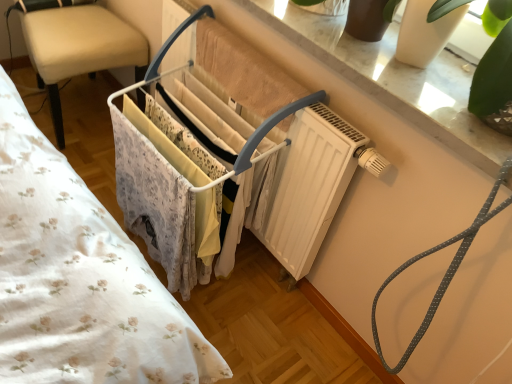
In order to click on gray dotted rope at upper right in this screenshot , I will do `click(446, 271)`.

Describe the element at coordinates (153, 199) in the screenshot. I see `white plastic clothes rack at center` at that location.

Where is `white plastic clothes rack at center`? The image size is (512, 384). white plastic clothes rack at center is located at coordinates (153, 199).

The width and height of the screenshot is (512, 384). What are the coordinates of `beige leather chair at left` in the screenshot? It's located at (77, 45).

From the image's perspective, is white marble window sill at upper center located above beige leather chair at left?

No, from the image's perspective, white marble window sill at upper center is not over beige leather chair at left.

In the scene shown: In the image, is white marble window sill at upper center on the left side or the right side of beige leather chair at left?

white marble window sill at upper center is to the right of beige leather chair at left.

Which of these two, white marble window sill at upper center or beige leather chair at left, is wider?

Wider between the two is beige leather chair at left.

Could you tell me if white marble window sill at upper center is facing beige leather chair at left?

No, white marble window sill at upper center is not facing towards beige leather chair at left.

From the image's perspective, is beige leather chair at left beneath white marble window sill at upper center?

Incorrect, from the image's perspective, beige leather chair at left is higher than white marble window sill at upper center.

Does beige leather chair at left have a lesser width compared to white marble window sill at upper center?

In fact, beige leather chair at left might be wider than white marble window sill at upper center.

Is beige leather chair at left not close to white marble window sill at upper center?

No, beige leather chair at left is not far away from white marble window sill at upper center.

Is gray dotted rope at upper right outside of white marble window sill at upper center?

gray dotted rope at upper right is positioned outside white marble window sill at upper center.

Is gray dotted rope at upper right bigger than white marble window sill at upper center?

Yes.

Would you consider gray dotted rope at upper right to be distant from white marble window sill at upper center?

Actually, gray dotted rope at upper right and white marble window sill at upper center are a little close together.

Is point (466, 229) farther from camera compared to point (371, 53)?

No, (466, 229) is closer to viewer.

Considering the sizes of white plastic clothes rack at center and beige leather chair at left in the image, is white plastic clothes rack at center bigger or smaller than beige leather chair at left?

Considering their sizes, white plastic clothes rack at center takes up more space than beige leather chair at left.

From the image's perspective, which one is positioned higher, white plastic clothes rack at center or beige leather chair at left?

From the image's view, beige leather chair at left is above.

What's the angular difference between white plastic clothes rack at center and beige leather chair at left's facing directions?

88 degrees.

Is white plastic clothes rack at center turned away from beige leather chair at left?

No, white plastic clothes rack at center's orientation is not away from beige leather chair at left.

Does gray dotted rope at upper right turn towards white plastic clothes rack at center?

No.

Does gray dotted rope at upper right have a lesser width compared to white plastic clothes rack at center?

Yes.

Is gray dotted rope at upper right taller than white plastic clothes rack at center?

Correct, gray dotted rope at upper right is much taller as white plastic clothes rack at center.

How many degrees apart are the facing directions of gray dotted rope at upper right and white plastic clothes rack at center?

There is a 5.69-degree angle between the facing directions of gray dotted rope at upper right and white plastic clothes rack at center.

Is point (494, 135) closer or farther from the camera than point (126, 137)?

Point (494, 135).

Who is bigger, white marble window sill at upper center or white plastic clothes rack at center?

Bigger between the two is white plastic clothes rack at center.

Is there a large distance between white marble window sill at upper center and white plastic clothes rack at center?

That's not correct — white marble window sill at upper center is a little close to white plastic clothes rack at center.

What's the angular difference between white marble window sill at upper center and white plastic clothes rack at center's facing directions?

1.02 degrees separate the facing orientations of white marble window sill at upper center and white plastic clothes rack at center.

Would you say white plastic clothes rack at center is inside or outside gray dotted rope at upper right?

white plastic clothes rack at center lies outside gray dotted rope at upper right.

Where is `closet lying above the gray dotted rope at upper right (from the image's perspective)`? closet lying above the gray dotted rope at upper right (from the image's perspective) is located at coordinates (153, 199).

Between white plastic clothes rack at center and gray dotted rope at upper right, which one is positioned in front?

gray dotted rope at upper right is closer to the camera.

What's the angular difference between white plastic clothes rack at center and gray dotted rope at upper right's facing directions?

5.69 degrees.

Where is `window sill above the beige leather chair at left (from a real-world perspective)`? The width and height of the screenshot is (512, 384). window sill above the beige leather chair at left (from a real-world perspective) is located at coordinates (394, 79).

This screenshot has width=512, height=384. In order to click on chair above the white marble window sill at upper center (from the image's perspective) in this screenshot , I will do `click(77, 45)`.

Which object lies further to the anchor point white marble window sill at upper center, white plastic clothes rack at center or beige leather chair at left?

The object further to white marble window sill at upper center is beige leather chair at left.

Based on their spatial positions, is gray dotted rope at upper right or white plastic clothes rack at center further from white marble window sill at upper center?

white plastic clothes rack at center is further to white marble window sill at upper center.

From the image, which object appears to be nearer to beige leather chair at left, gray dotted rope at upper right or white plastic clothes rack at center?

white plastic clothes rack at center.

Which object lies nearer to the anchor point beige leather chair at left, white plastic clothes rack at center or white marble window sill at upper center?

white plastic clothes rack at center lies closer to beige leather chair at left than the other object.

Looking at the image, which one is located closer to gray dotted rope at upper right, white plastic clothes rack at center or white marble window sill at upper center?

white marble window sill at upper center.

Estimate the real-world distances between objects in this image. Which object is closer to gray dotted rope at upper right, white plastic clothes rack at center or beige leather chair at left?

white plastic clothes rack at center is closer to gray dotted rope at upper right.

Which object lies nearer to the anchor point white marble window sill at upper center, beige leather chair at left or gray dotted rope at upper right?

The object closer to white marble window sill at upper center is gray dotted rope at upper right.

Looking at the image, which one is located closer to gray dotted rope at upper right, beige leather chair at left or white marble window sill at upper center?

white marble window sill at upper center is positioned closer to the anchor gray dotted rope at upper right.

The height and width of the screenshot is (384, 512). In order to click on closet between beige leather chair at left and gray dotted rope at upper right from left to right in this screenshot , I will do `click(153, 199)`.

This screenshot has height=384, width=512. Identify the location of window sill situated between beige leather chair at left and gray dotted rope at upper right from left to right. (394, 79).

Where is `window sill between white plastic clothes rack at center and gray dotted rope at upper right`? window sill between white plastic clothes rack at center and gray dotted rope at upper right is located at coordinates (394, 79).

This screenshot has height=384, width=512. Find the location of `closet situated between beige leather chair at left and white marble window sill at upper center from left to right`. closet situated between beige leather chair at left and white marble window sill at upper center from left to right is located at coordinates (153, 199).